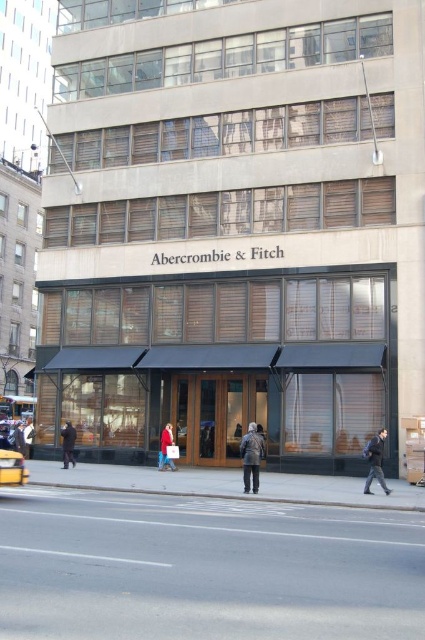
You are standing at a point 88 feet away from a building with a modern architectural style. The building has large rectangular windows with horizontal blinds and a light colored exterior. There is a sign for Abercrombie and Fitch on the ground floor. If you want to take a photo of the point at coordinate (22, 432) on the building, which direction should you move relative to your current position?

The point at coordinate (22, 432) is 88.00 feet away from the viewer. Since you are already 88 feet away from the building, you are already at the correct distance to take a photo of the point at coordinate (22, 432). No movement is needed.

Consider the image. You are a pedestrian standing in front of the Abercrombie and Fitch store. You see a dark gray coat at center and a yellow rubber taxi at lower left. Which object is closer to you?

The dark gray coat at center is closer to you because the yellow rubber taxi at lower left is behind it.

You are a customer looking for the entrance to Abercrombie and Fitch store. You see the dark gray jacket at center and the dark brown leather coat at lower left. Which direction should you walk to reach the store entrance?

The dark gray jacket at center is to the right of the dark brown leather coat at lower left. Since the store entrance is typically located at the front of the building, which is likely where the signage is placed, you should walk towards the direction where the dark brown leather coat at lower left is positioned to reach the entrance.